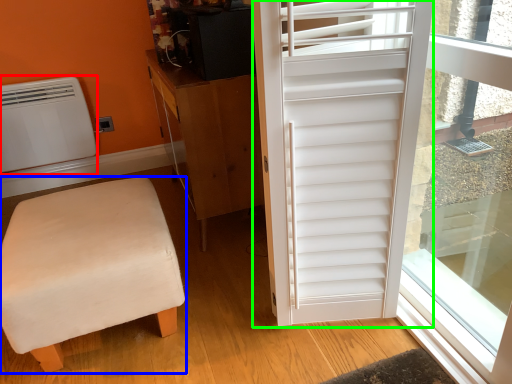
Question: Which is nearer to the air conditioning (highlighted by a red box)? furniture (highlighted by a blue box) or door (highlighted by a green box).

Choices:
 (A) furniture
 (B) door

Answer: (A)